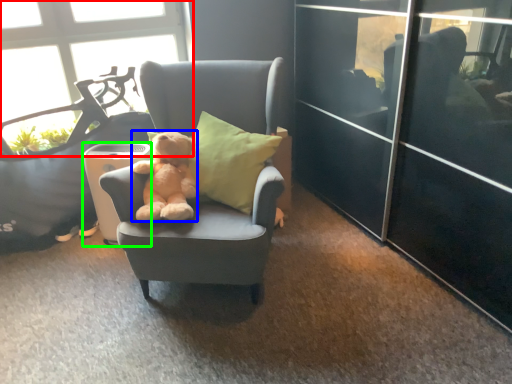
Question: Based on their relative distances, which object is farther from window (highlighted by a red box)? Choose from teddy bear (highlighted by a blue box) and trash bin/can (highlighted by a green box).

Choices:
 (A) teddy bear
 (B) trash bin/can

Answer: (A)